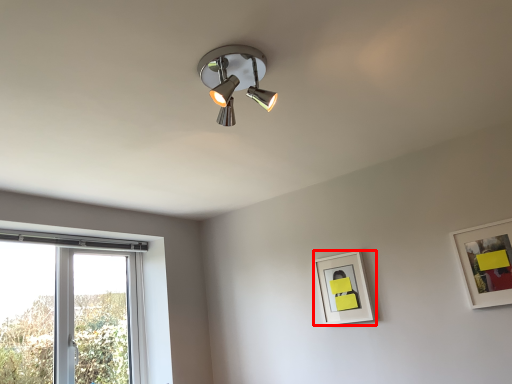
Question: Where is picture frame (annotated by the red box) located in relation to picture frame in the image?

Choices:
 (A) left
 (B) right

Answer: (A)